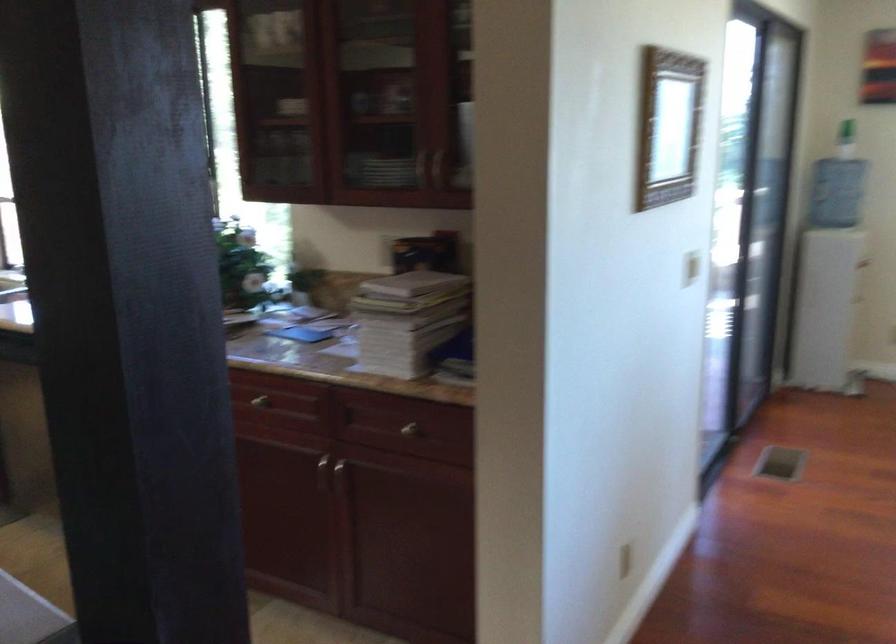
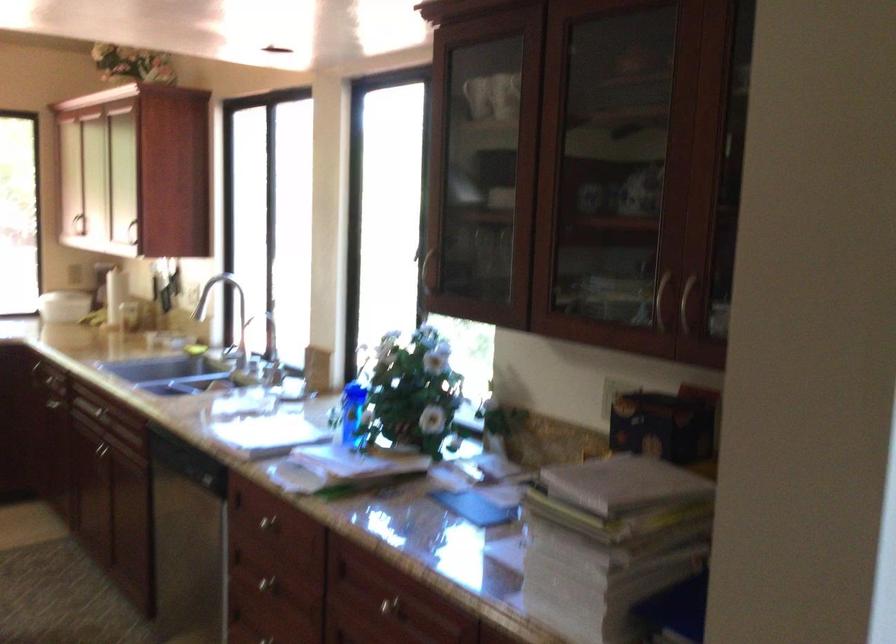
Locate, in the second image, the point that corresponds to (254,401) in the first image.

(386, 605)